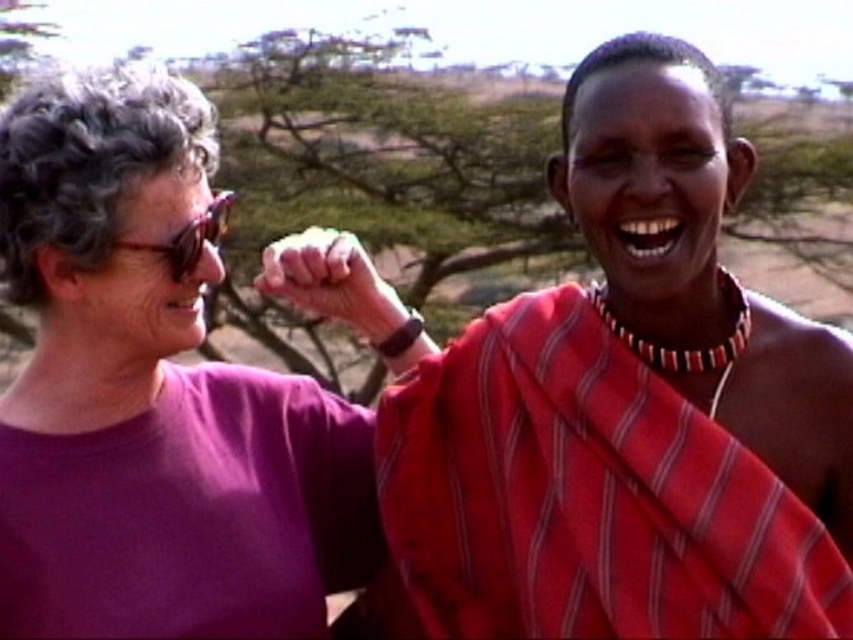
You are organizing a small outdoor event and need to know which item takes up more space between the red striped cloth at center and the purple matte shirt at left. Which one should you consider for storage?

The purple matte shirt at left occupies more space than the red striped cloth at center, so you should consider storing the purple matte shirt at left first.

Consider the image. You are a photographer trying to capture a photo of the two individuals in the scene. The red striped cloth at center is blocking part of the background. To ensure the background is fully visible, should you move the camera to the left or right?

The red striped cloth at center is located at point (630, 406), so moving the camera to the right would shift the view away from the cloth, allowing the background to become more visible.